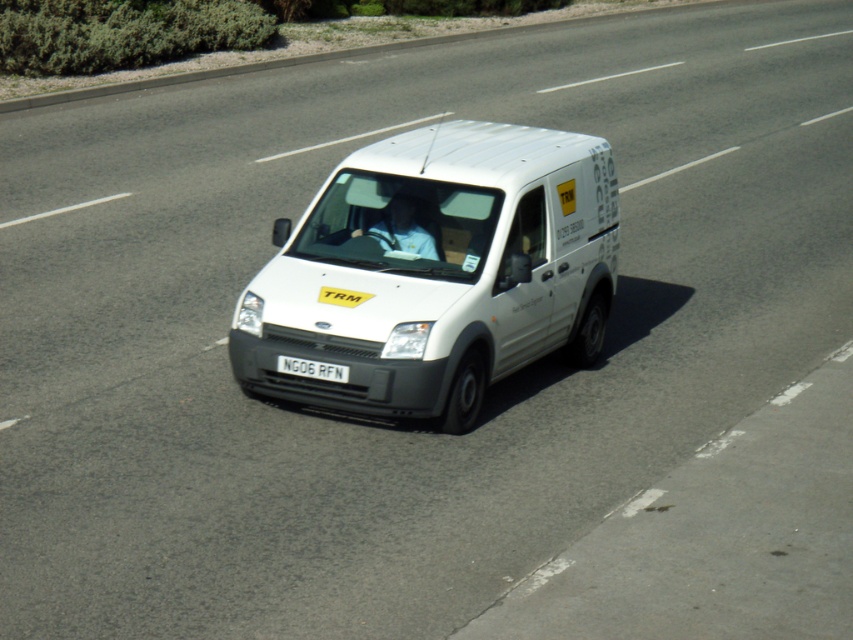
Question: Is white matte van at center in front of white plastic license plate at center?

Choices:
 (A) no
 (B) yes

Answer: (B)

Question: Is white matte van at center below white plastic license plate at center?

Choices:
 (A) yes
 (B) no

Answer: (B)

Question: Which point appears farthest from the camera in this image?

Choices:
 (A) (523, 209)
 (B) (343, 378)

Answer: (A)

Question: Is white matte van at center to the right of white plastic license plate at center from the viewer's perspective?

Choices:
 (A) yes
 (B) no

Answer: (A)

Question: Which point appears closest to the camera in this image?

Choices:
 (A) (563, 131)
 (B) (312, 365)

Answer: (B)

Question: Which point is closer to the camera?

Choices:
 (A) (306, 364)
 (B) (556, 321)

Answer: (A)